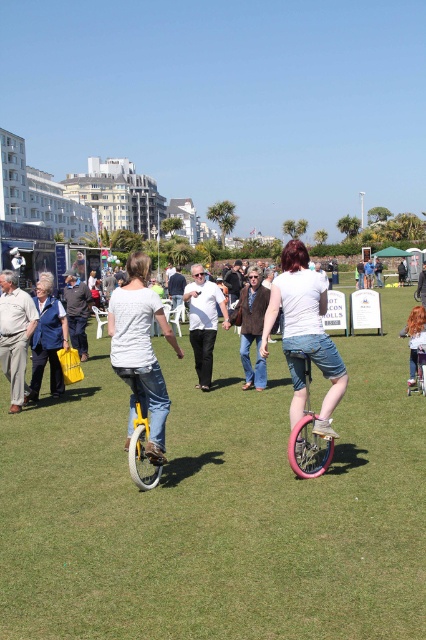
You are a photographer planning to take a photo of the green grass at center and the blue denim jacket at left. Based on their heights, which one should you focus on first if you want to ensure both are in focus?

The green grass at center has a lesser height compared to blue denim jacket at left, so you should focus on the blue denim jacket at left first to ensure both are in focus.

You are standing at the center of the park and see a point marked at coordinates (252, 326). Which object is this point located on?

The point at coordinates (252, 326) is located on the brown woolen vest at center.